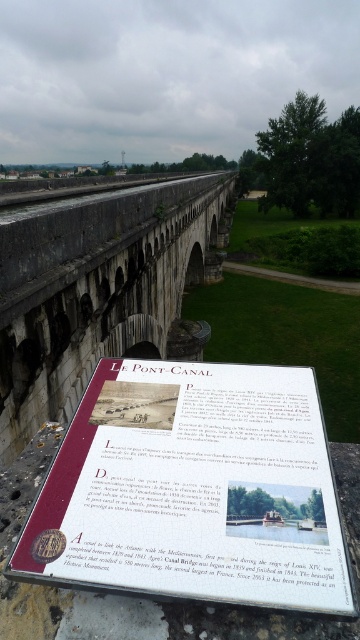
You are a tourist standing in front of the gray stone aqueduct at center and want to read the white paper sign at center. Which direction should you turn your head to look at the sign?

The white paper sign at center is positioned on the left side of the gray stone aqueduct at center, so you should turn your head to the left to look at the sign.